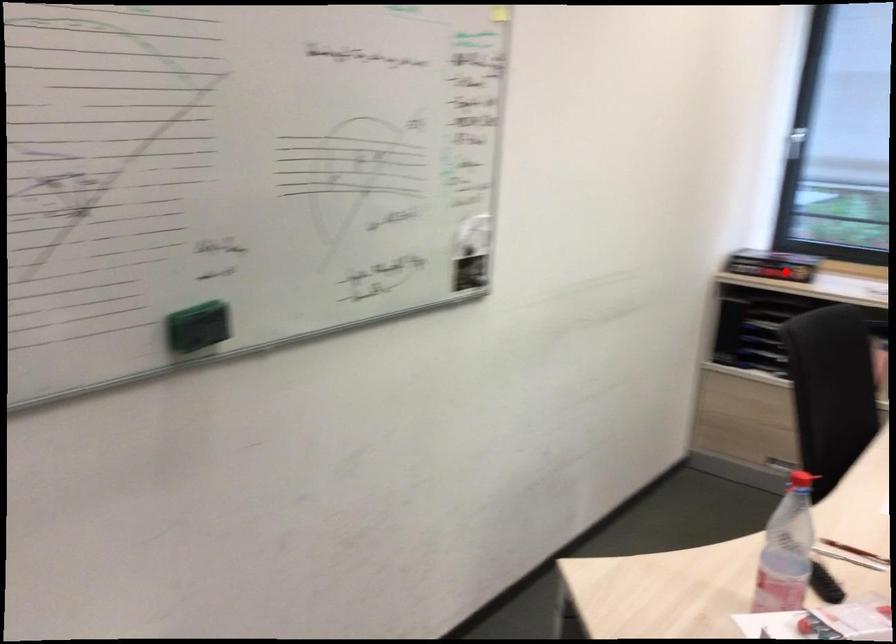
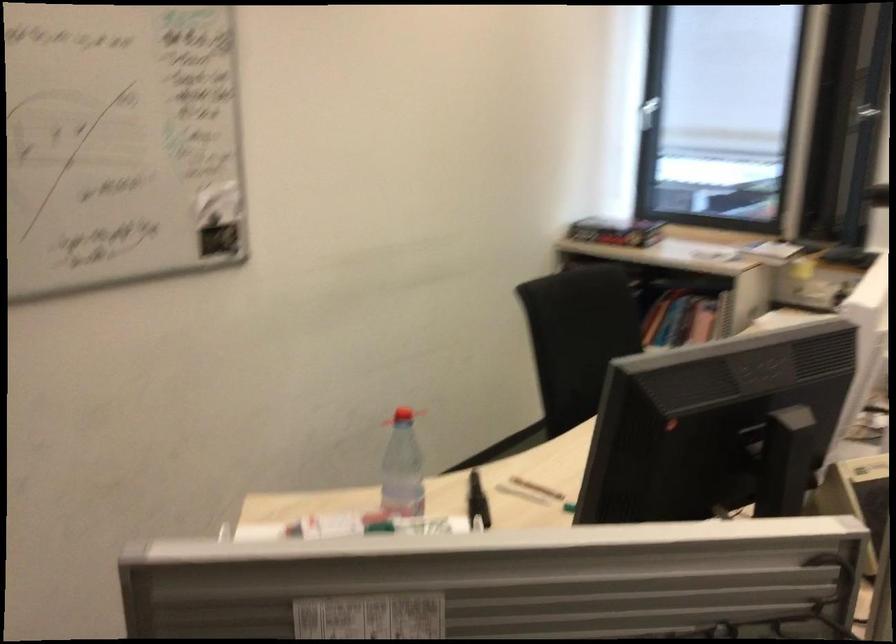
The point at the highlighted location is marked in the first image. Where is the corresponding point in the second image?

(615, 232)